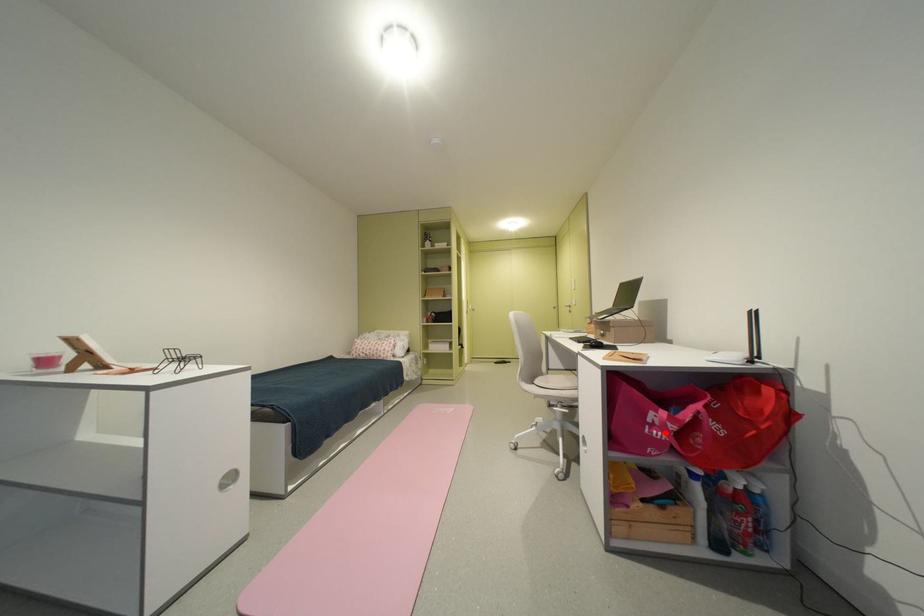
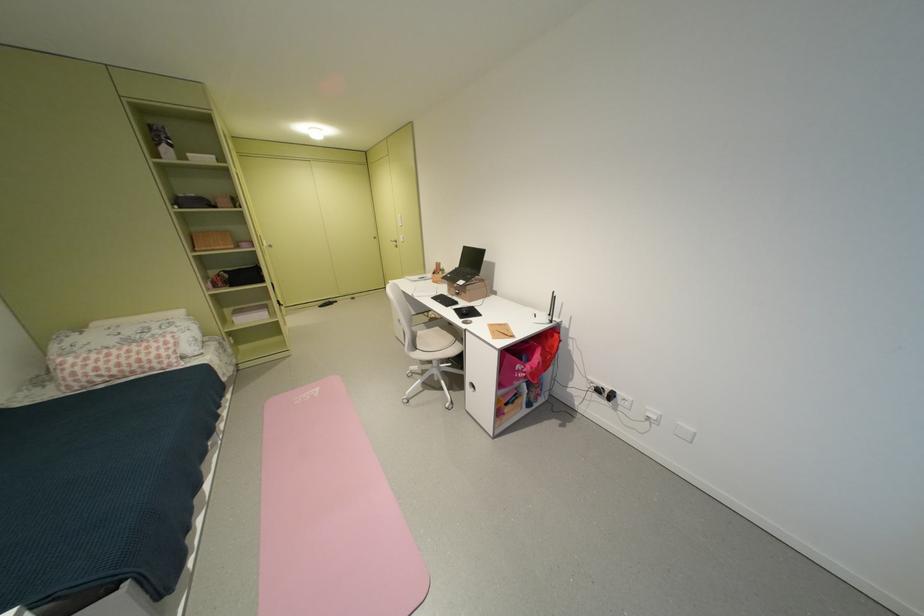
Where in the second image is the point corresponding to the highlighted location from the first image?

(530, 376)